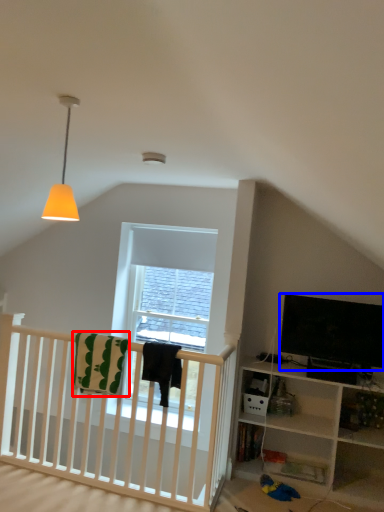
Question: Which point is closer to the camera, blanket (highlighted by a red box) or television (highlighted by a blue box)?

Choices:
 (A) blanket
 (B) television

Answer: (A)